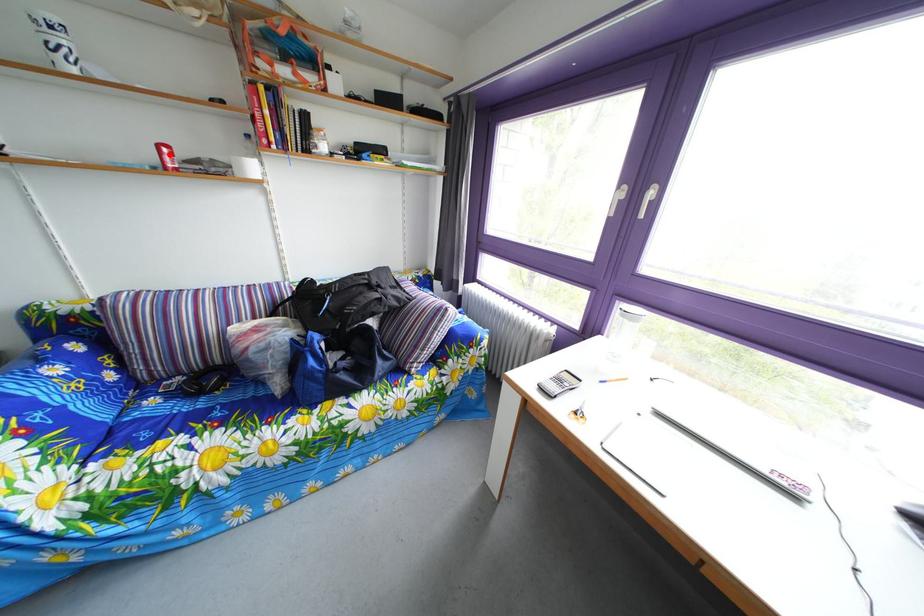
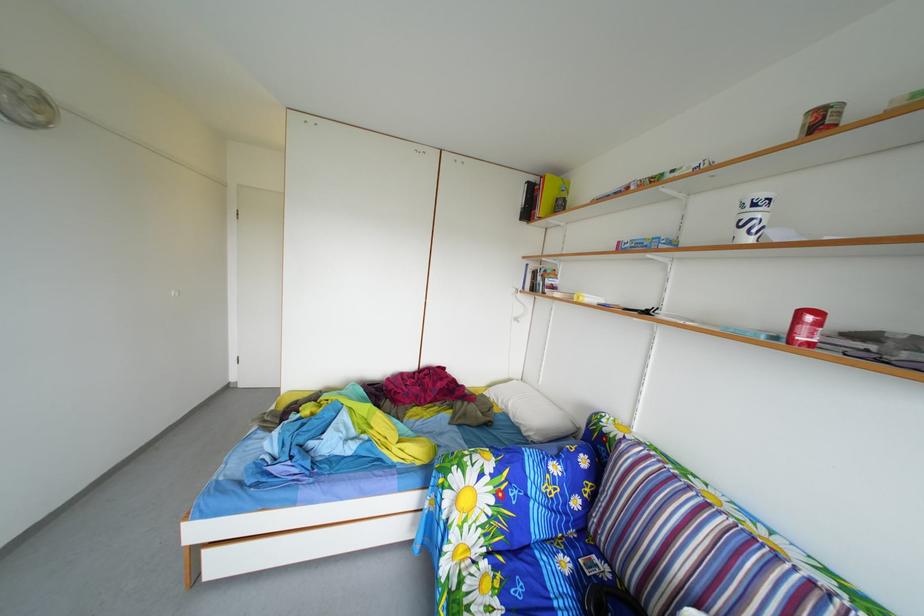
Where in the second image is the point corresponding to the highlighted location from the first image?

(811, 321)